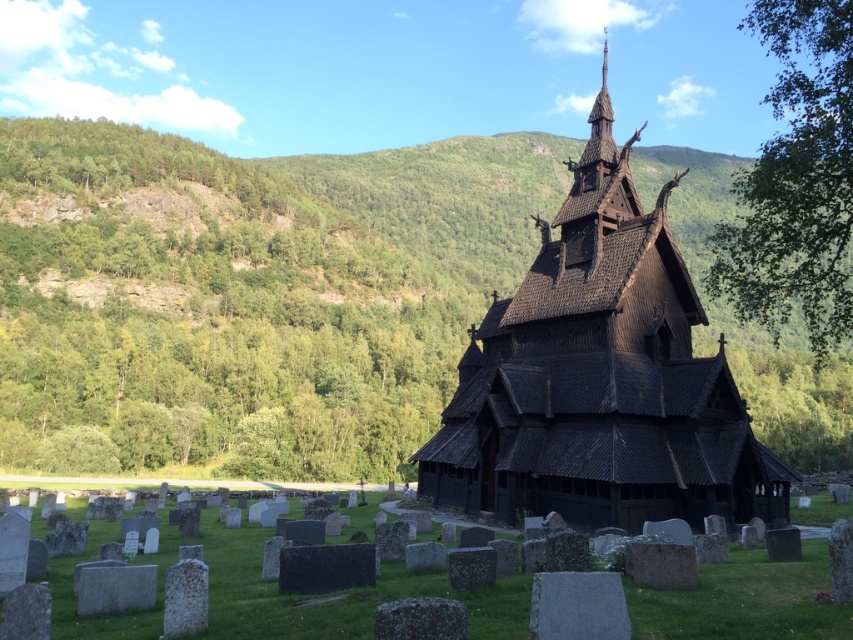
Is black wooden church at center to the left of green leafy tree at upper right from the viewer's perspective?

Yes, black wooden church at center is to the left of green leafy tree at upper right.

Is black wooden church at center bigger than green leafy tree at upper right?

No, black wooden church at center is not bigger than green leafy tree at upper right.

Does point (630, 419) lie behind point (811, 342)?

No, it is not.

The width and height of the screenshot is (853, 640). Identify the location of black wooden church at center. (601, 378).

Does green leafy hillside at upper left have a smaller size compared to black wooden church at center?

No.

Between green leafy hillside at upper left and black wooden church at center, which one appears on the left side from the viewer's perspective?

From the viewer's perspective, green leafy hillside at upper left appears more on the left side.

Measure the distance between green leafy hillside at upper left and camera.

green leafy hillside at upper left is 65.06 meters from camera.

Locate an element on the screen. green leafy hillside at upper left is located at coordinates (248, 291).

Does green leafy hillside at upper left have a greater width compared to green leafy tree at upper right?

Yes.

Does green leafy hillside at upper left have a smaller size compared to green leafy tree at upper right?

No.

You are a GUI agent. You are given a task and a screenshot of the screen. Output one action in this format:
    pyautogui.click(x=<x>, y=<y>)
    Task: Click on the green leafy hillside at upper left
    This screenshot has height=640, width=853.
    Given the screenshot: What is the action you would take?
    pyautogui.click(x=248, y=291)

Where is `green leafy hillside at upper left`? The width and height of the screenshot is (853, 640). green leafy hillside at upper left is located at coordinates (248, 291).